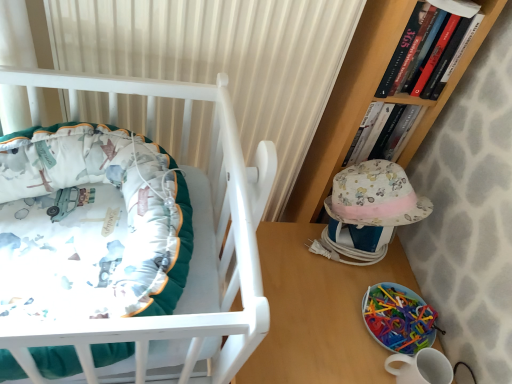
The width and height of the screenshot is (512, 384). I want to click on free spot above wooden table at lower right (from a real-world perspective), so click(333, 295).